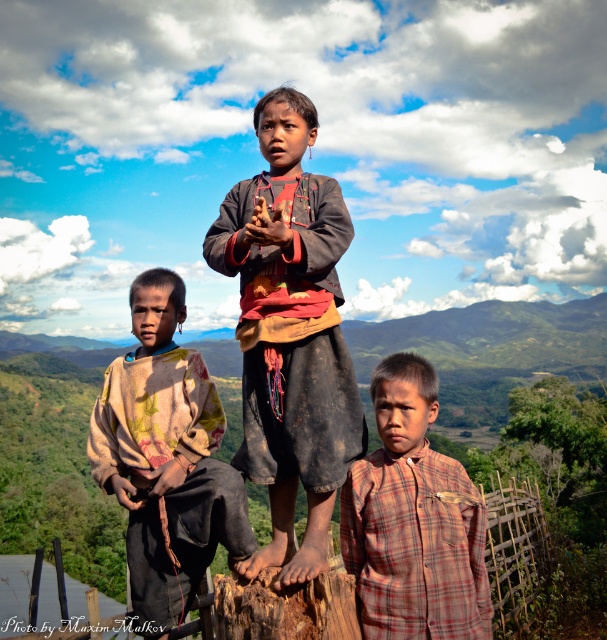
Does dirty brown fabric shirt at center have a lesser height compared to plaid fabric shirt at lower right?

Yes, dirty brown fabric shirt at center is shorter than plaid fabric shirt at lower right.

How distant is dirty brown fabric shirt at center from plaid fabric shirt at lower right?

They are 62.18 centimeters apart.

The width and height of the screenshot is (607, 640). Find the location of `dirty brown fabric shirt at center`. dirty brown fabric shirt at center is located at coordinates (290, 332).

Is dirty brown fabric shirt at center closer to camera compared to rustic brown shirt at left?

Yes, dirty brown fabric shirt at center is closer to the viewer.

Between dirty brown fabric shirt at center and rustic brown shirt at left, which one has more height?

rustic brown shirt at left is taller.

Between point (341, 369) and point (171, 348), which one is positioned behind?

Point (171, 348)

Identify the location of dirty brown fabric shirt at center. This screenshot has height=640, width=607. click(290, 332).

Is the position of rustic brown shirt at left more distant than that of plaid fabric shirt at lower right?

Yes, rustic brown shirt at left is behind plaid fabric shirt at lower right.

Which is more to the right, rustic brown shirt at left or plaid fabric shirt at lower right?

plaid fabric shirt at lower right is more to the right.

Is point (171, 284) positioned behind point (469, 497)?

Yes, point (171, 284) is behind point (469, 497).

Where is `rustic brown shirt at left`? rustic brown shirt at left is located at coordinates (164, 458).